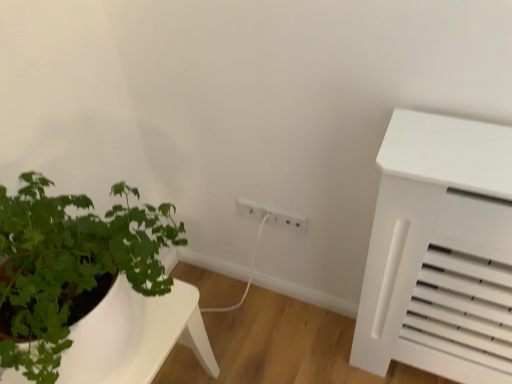
Question: From a real-world perspective, relative to white matte table at lower left, is white plastic electric outlet at center, placed as the first electric outlet when sorted from right to left, vertically above or below?

Choices:
 (A) below
 (B) above

Answer: (B)

Question: From their relative heights in the image, would you say white plastic electric outlet at center, acting as the 2th electric outlet starting from the left, is taller or shorter than white matte table at lower left?

Choices:
 (A) short
 (B) tall

Answer: (A)

Question: Estimate the real-world distances between objects in this image. Which object is closer to the white plastic electric outlet at center, which appears as the 2th electric outlet when viewed from the right?

Choices:
 (A) green leafy plant at left
 (B) white plastic electric outlet at center, acting as the 2th electric outlet starting from the left
 (C) white matte table at lower left

Answer: (B)

Question: Which object is positioned farthest from the white plastic electric outlet at center, which appears as the 2th electric outlet when viewed from the right?

Choices:
 (A) green leafy plant at left
 (B) white matte table at lower left
 (C) white plastic electric outlet at center, placed as the first electric outlet when sorted from right to left

Answer: (A)